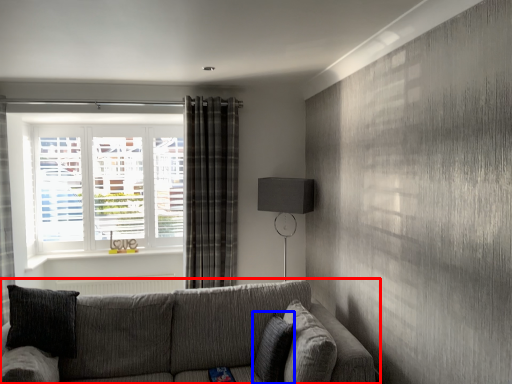
Question: Among these objects, which one is farthest to the camera, studio couch (highlighted by a red box) or pillow (highlighted by a blue box)?

Choices:
 (A) studio couch
 (B) pillow

Answer: (B)